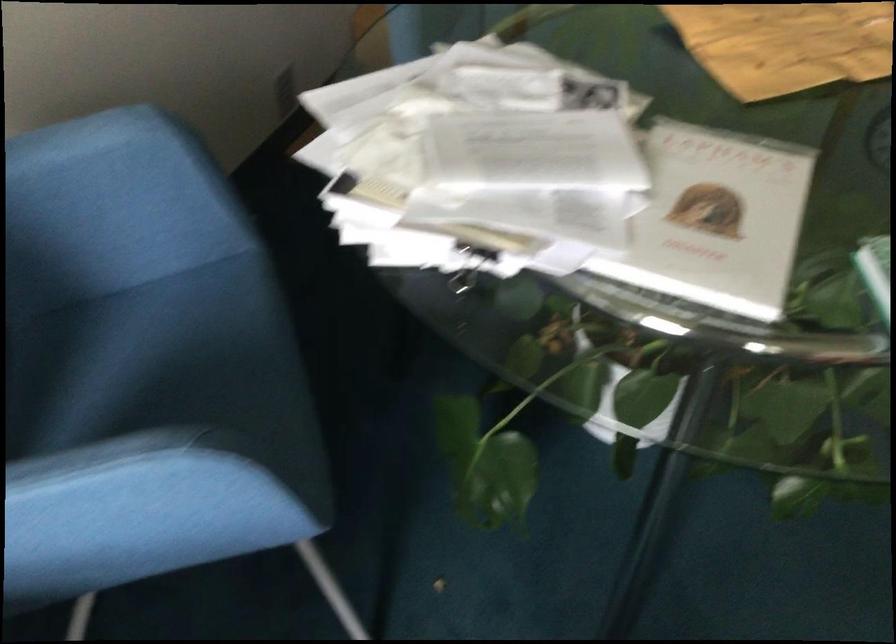
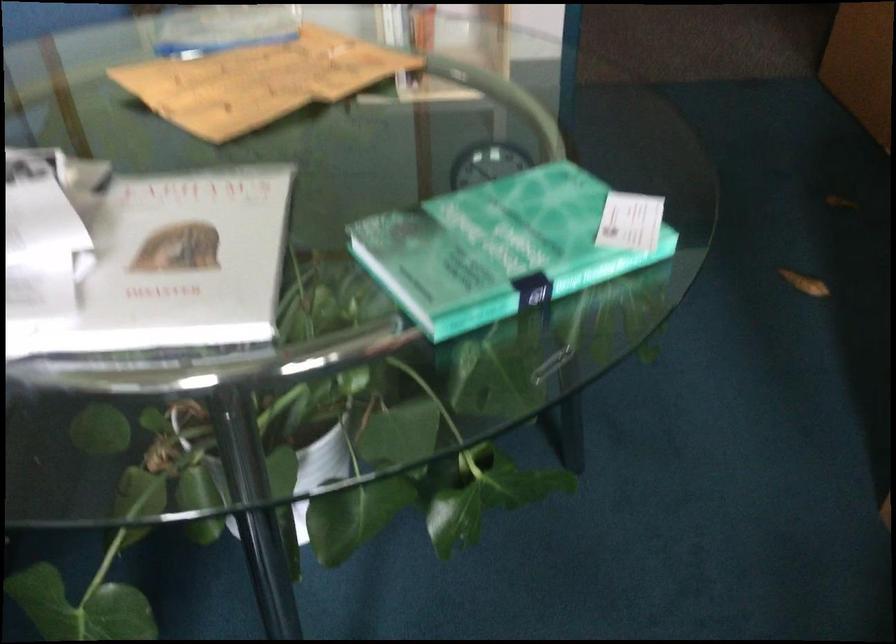
Question: The camera is either moving clockwise (left) or counter-clockwise (right) around the object. The first image is from the beginning of the video and the second image is from the end. Is the camera moving left or right when shooting the video?

Choices:
 (A) Left
 (B) Right

Answer: (A)